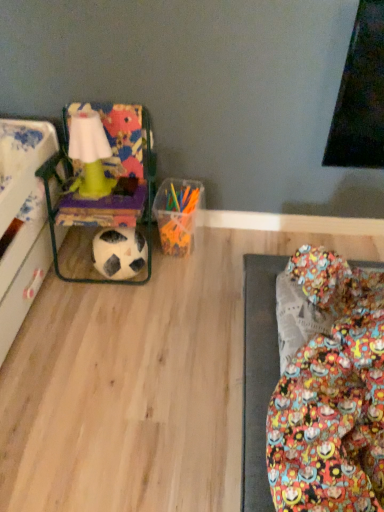
Locate an element on the screen. The image size is (384, 512). free space in front of multicolored fabric bean bag chair at left is located at coordinates (98, 326).